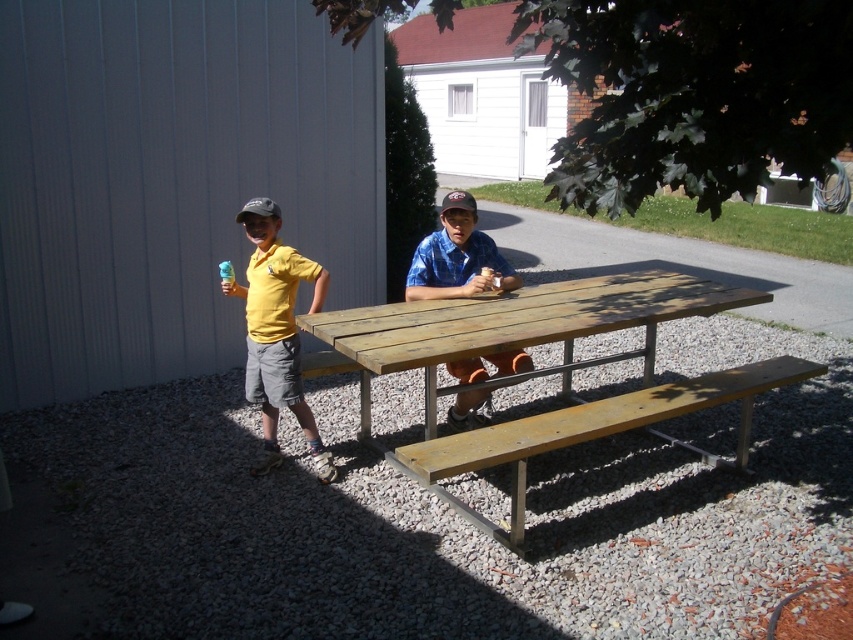
Can you confirm if weathered wood picnic table at center is positioned to the left of light brown wooden bench at center?

Indeed, weathered wood picnic table at center is positioned on the left side of light brown wooden bench at center.

Is weathered wood picnic table at center smaller than light brown wooden bench at center?

Actually, weathered wood picnic table at center might be larger than light brown wooden bench at center.

The image size is (853, 640). I want to click on weathered wood picnic table at center, so click(514, 328).

Which is above, weathered wood picnic table at center or yellow matte shirt at left?

Positioned higher is yellow matte shirt at left.

What do you see at coordinates (514, 328) in the screenshot?
I see `weathered wood picnic table at center` at bounding box center [514, 328].

Locate an element on the screen. weathered wood picnic table at center is located at coordinates (514, 328).

Is point (770, 442) in front of point (346, 337)?

No, it is not.

Between gray gravel at lower center and weathered wood picnic table at center, which one has less height?

Standing shorter between the two is gray gravel at lower center.

Is point (25, 454) behind point (364, 326)?

That is True.

At what (x,y) coordinates should I click in order to perform the action: click on gray gravel at lower center. Please return your answer as a coordinate pair (x, y). This screenshot has height=640, width=853. Looking at the image, I should click on (419, 518).